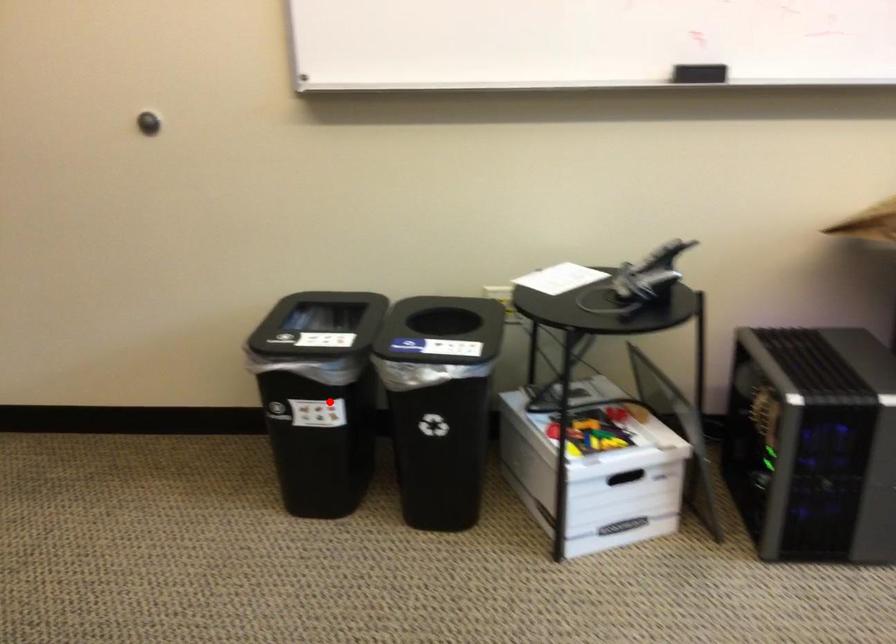
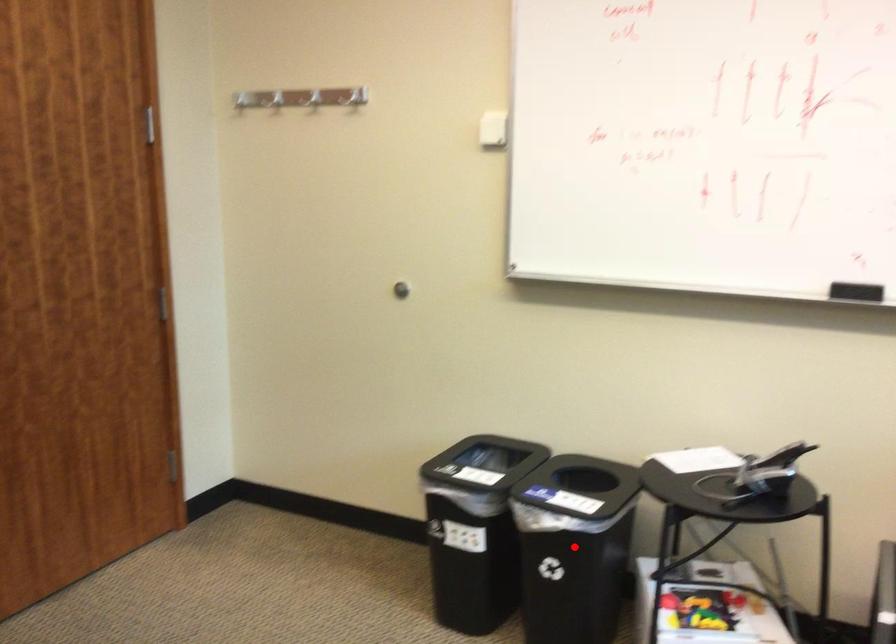
I am providing you with two images of the same scene from different viewpoints. A red point is marked on the first image and another point is marked on the second image. Is the red point in image1 aligned with the point shown in image2?

No